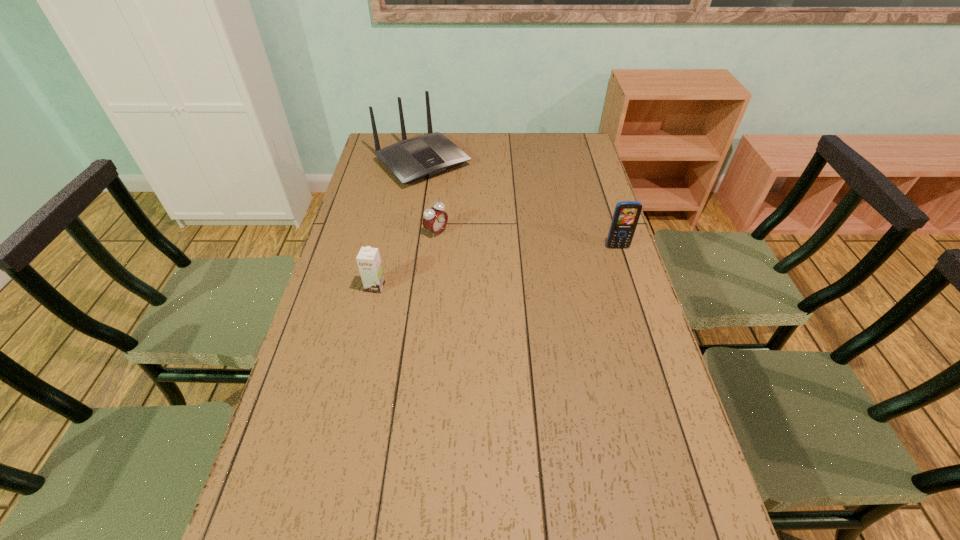
Find the location of a particular element. The height and width of the screenshot is (540, 960). free region that satisfies the following two spatial constraints: 1. on the back side of the second shortest object; 2. on the right side of the alarm clock is located at coordinates (388, 232).

Image resolution: width=960 pixels, height=540 pixels. I want to click on free spot that satisfies the following two spatial constraints: 1. on the back side of the nearest object; 2. on the left side of the second farthest object, so click(x=388, y=232).